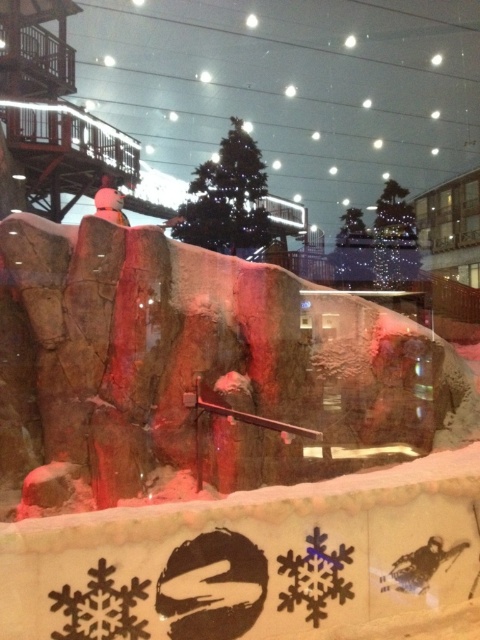
Question: Which point is closer to the camera?

Choices:
 (A) black matte snowflake at lower left
 (B) black paper snowflake at lower center
 (C) white matte snowboarder at center

Answer: (A)

Question: Is black matte snowflake at lower left below white matte snowboarder at center?

Choices:
 (A) no
 (B) yes

Answer: (B)

Question: Is the position of black matte snowflake at lower left more distant than that of black paper snowflake at lower center?

Choices:
 (A) no
 (B) yes

Answer: (A)

Question: Does green matte christmas tree at center lie in front of black matte snowflake at lower left?

Choices:
 (A) no
 (B) yes

Answer: (A)

Question: Among these objects, which one is nearest to the camera?

Choices:
 (A) green matte christmas tree at center
 (B) white matte snowboarder at center

Answer: (B)

Question: Which object is positioned farthest from the white matte snowboarder at center?

Choices:
 (A) black paper snowflake at lower center
 (B) black matte snowflake at lower left

Answer: (A)